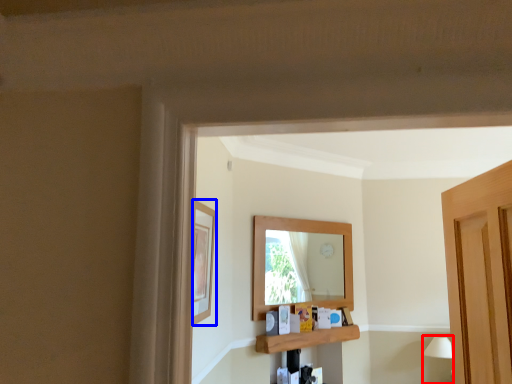
Question: Which object appears farthest to the camera in this image, lamp (highlighted by a red box) or picture frame (highlighted by a blue box)?

Choices:
 (A) lamp
 (B) picture frame

Answer: (A)